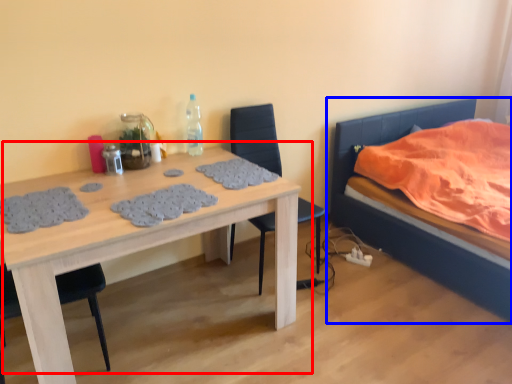
Question: Which object is further to the camera taking this photo, table (highlighted by a red box) or bed (highlighted by a blue box)?

Choices:
 (A) table
 (B) bed

Answer: (B)